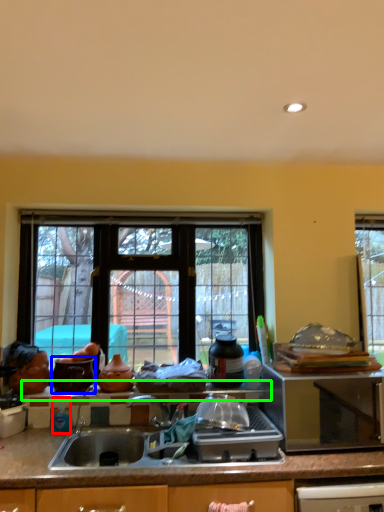
Question: Which object is positioned farthest from bottle (highlighted by a red box)? Select from appliance (highlighted by a blue box) and window sill (highlighted by a green box).

Choices:
 (A) appliance
 (B) window sill

Answer: (B)